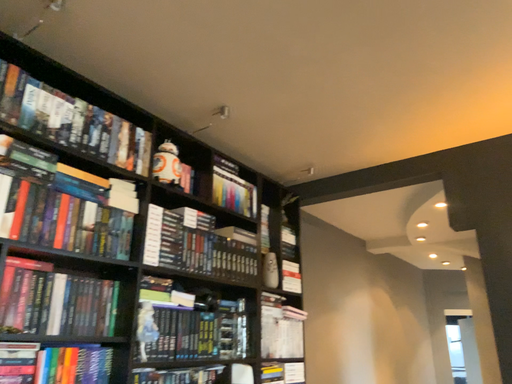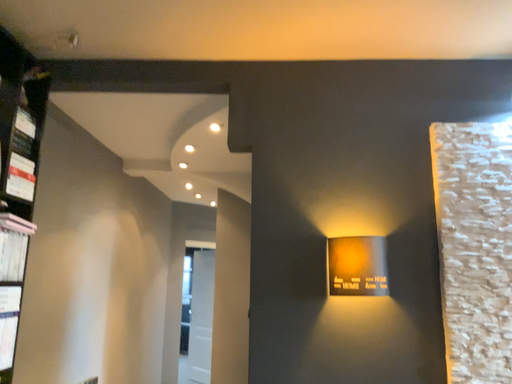
Question: How did the camera likely rotate when shooting the video?

Choices:
 (A) rotated upward
 (B) rotated downward

Answer: (B)